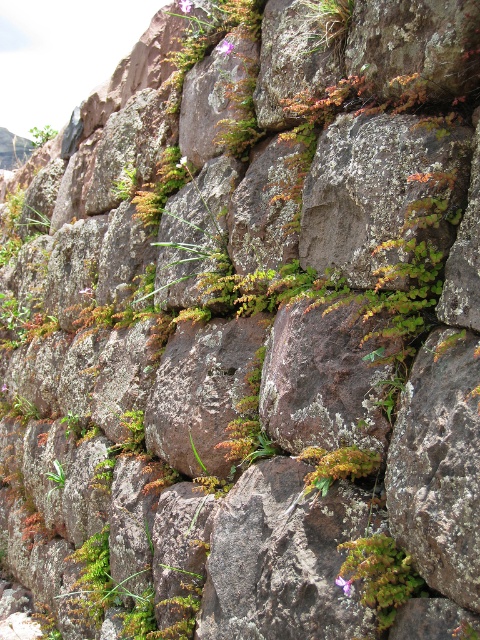
Who is more forward, (382, 600) or (334, 458)?

Point (382, 600) is more forward.

Is green mossy plant at lower right behind green mossy plant at center?

No, it is in front of green mossy plant at center.

You are a GUI agent. You are given a task and a screenshot of the screen. Output one action in this format:
    pyautogui.click(x=<x>, y=<y>)
    Task: Click on the green mossy plant at lower right
    The image size is (480, 640).
    Given the screenshot: What is the action you would take?
    pyautogui.click(x=380, y=573)

Does green mossy rock at upper center have a larger size compared to green leafy plant at upper left?

No.

Which is below, green mossy rock at upper center or green leafy plant at upper left?

green mossy rock at upper center

Is point (326, 24) positioned before point (43, 144)?

Yes, it is.

In order to click on green mossy rock at upper center in this screenshot , I will do `click(324, 22)`.

Consider the image. Who is shorter, green mossy plant at lower right or green mossy rock at upper center?

green mossy plant at lower right is shorter.

Does point (351, 564) come behind point (317, 36)?

No, it is not.

Which is in front, point (347, 544) or point (305, 45)?

Point (347, 544) is in front.

Find the location of a particular element. The width and height of the screenshot is (480, 640). green mossy plant at lower right is located at coordinates click(x=380, y=573).